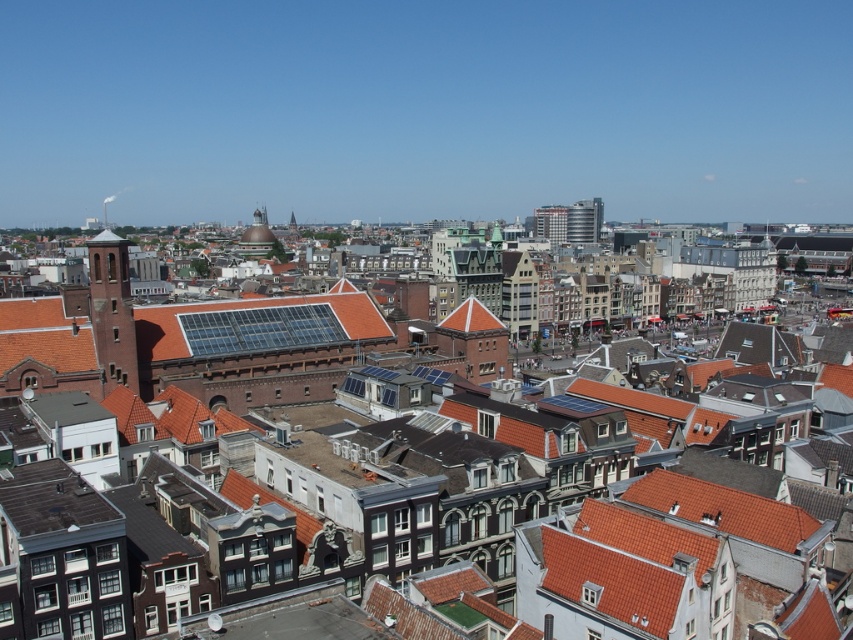
Question: Among these points, which one is farthest from the camera?

Choices:
 (A) (91, 240)
 (B) (218, 317)
 (C) (184, 337)

Answer: (B)

Question: Is translucent glass solar panels at center closer to the viewer compared to dark brown stone tower at left?

Choices:
 (A) no
 (B) yes

Answer: (A)

Question: Does brown tiled roof at center appear under dark brown stone tower at left?

Choices:
 (A) yes
 (B) no

Answer: (B)

Question: Estimate the real-world distances between objects in this image. Which object is farther from the translucent glass solar panels at center?

Choices:
 (A) brown tiled roof at center
 (B) dark brown stone tower at left

Answer: (B)

Question: Is translucent glass solar panels at center behind dark brown stone tower at left?

Choices:
 (A) yes
 (B) no

Answer: (A)

Question: Which is nearer to the dark brown stone tower at left?

Choices:
 (A) brown tiled roof at center
 (B) translucent glass solar panels at center

Answer: (B)